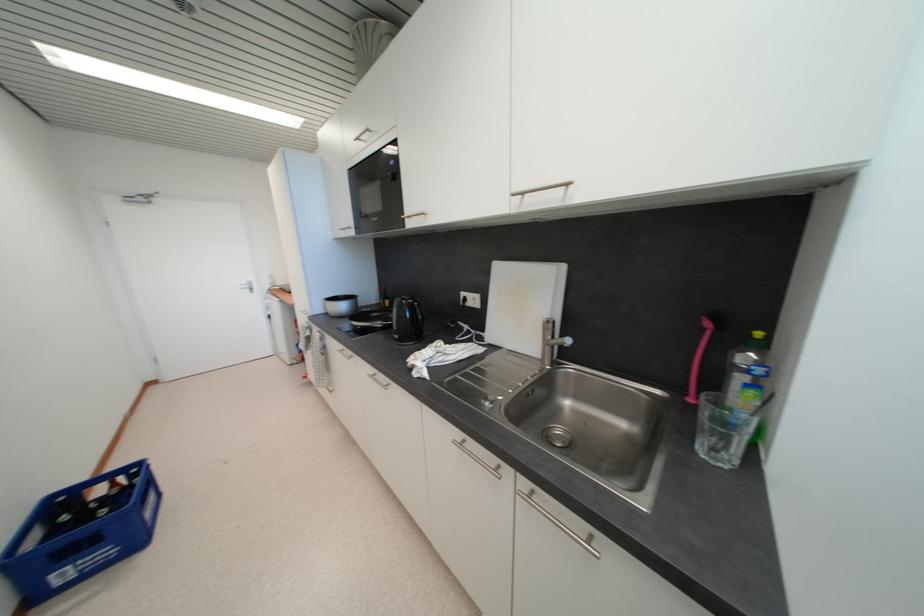
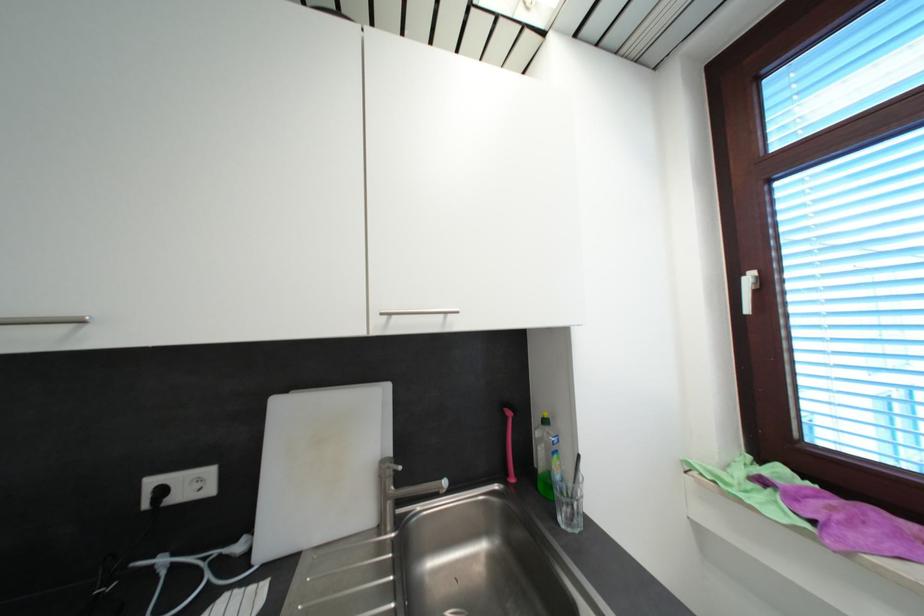
Find the pixel in the second image that matches (x=704, y=444) in the first image.

(565, 522)